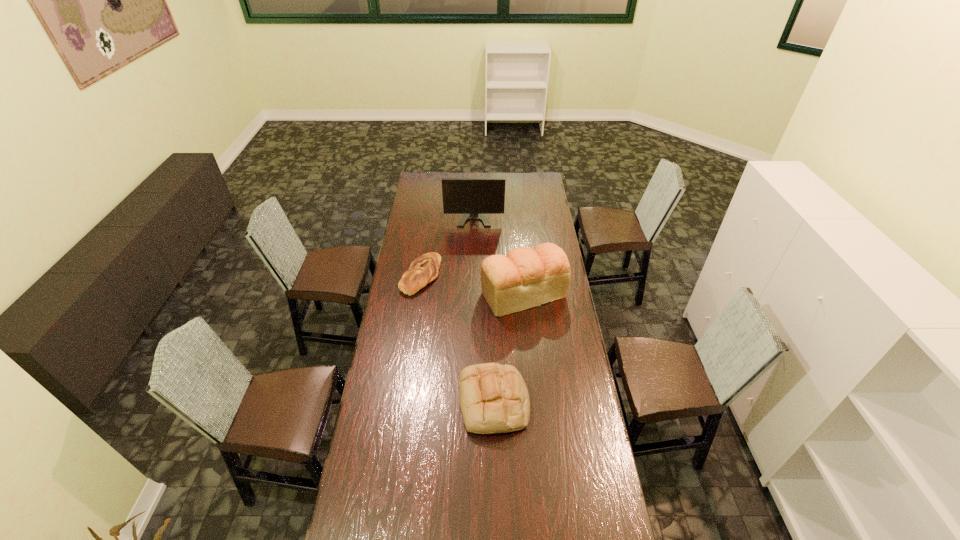
Find the location of a particular element. The image size is (960, 540). object at the left edge is located at coordinates (424, 269).

What are the coordinates of `object at the right edge` in the screenshot? It's located at (524, 278).

In the image, there is a desktop. At what (x,y) coordinates should I click in order to perform the action: click on vacant space at the far edge. Please return your answer as a coordinate pair (x, y). This screenshot has height=540, width=960. Looking at the image, I should click on (465, 178).

Locate an element on the screen. Image resolution: width=960 pixels, height=540 pixels. vacant point at the left edge is located at coordinates (393, 314).

Identify the location of free space at the right edge of the desktop. (588, 509).

At what (x,y) coordinates should I click in order to perform the action: click on vacant space at the far right corner. Please return your answer as a coordinate pair (x, y). Image resolution: width=960 pixels, height=540 pixels. Looking at the image, I should click on (537, 187).

Locate an element on the screen. This screenshot has width=960, height=540. free space between the second tallest object and the shortest bread is located at coordinates (472, 284).

At what (x,y) coordinates should I click in order to perform the action: click on free point between the shortest bread and the second shortest bread. Please return your answer as a coordinate pair (x, y). The image size is (960, 540). Looking at the image, I should click on (457, 339).

I want to click on free spot between the shortest bread and the second tallest bread, so click(457, 339).

At what (x,y) coordinates should I click in order to perform the action: click on vacant region between the second shortest bread and the leftmost bread. Please return your answer as a coordinate pair (x, y). This screenshot has height=540, width=960. Looking at the image, I should click on (457, 339).